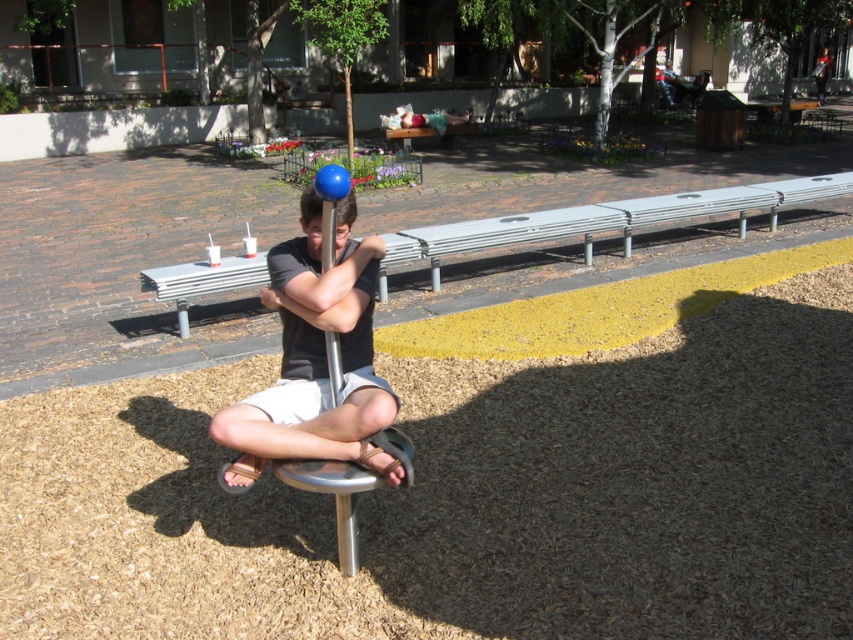
From the picture: Is the position of metallic silver bench at center less distant than that of blue glossy pole at center?

No, it is behind blue glossy pole at center.

Does point (795, 188) come behind point (323, 195)?

Yes.

Identify the location of metallic silver bench at center. The image size is (853, 640). (601, 221).

Who is more forward, (x=253, y=426) or (x=323, y=248)?

Point (x=253, y=426) is more forward.

Between matte black man at center and blue glossy pole at center, which one is positioned higher?

blue glossy pole at center is above.

Is point (253, 456) closer to viewer compared to point (328, 256)?

No, it is behind (328, 256).

Where is `matte black man at center`? The image size is (853, 640). matte black man at center is located at coordinates (316, 360).

Who is positioned more to the left, matte black man at center or metallic silver bench at center?

metallic silver bench at center is more to the left.

Is matte black man at center to the right of metallic silver bench at center from the viewer's perspective?

Indeed, matte black man at center is positioned on the right side of metallic silver bench at center.

Locate an element on the screen. The image size is (853, 640). matte black man at center is located at coordinates (316, 360).

Find the location of a particular element. The image size is (853, 640). matte black man at center is located at coordinates (316, 360).